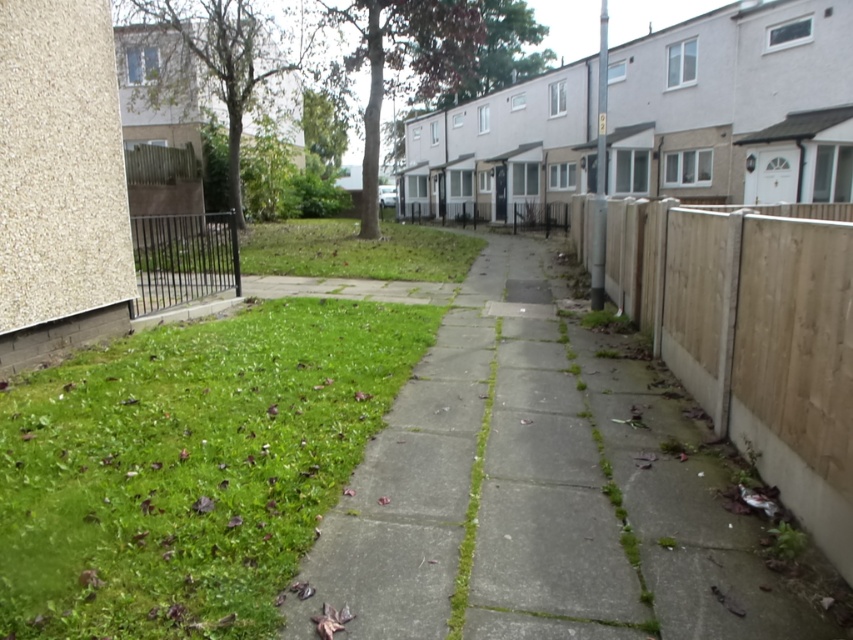
Question: Can you confirm if brown wooden fence at right is wider than black metal fence at lower left?

Choices:
 (A) yes
 (B) no

Answer: (B)

Question: Which of the following is the farthest from the observer?

Choices:
 (A) (126, 464)
 (B) (619, 284)
 (C) (590, 461)
 (D) (155, 264)

Answer: (D)

Question: Does green concrete pavement at center appear on the right side of black metal fence at lower left?

Choices:
 (A) no
 (B) yes

Answer: (B)

Question: Does green grass at lower left come behind brown wooden fence at right?

Choices:
 (A) no
 (B) yes

Answer: (A)

Question: Among these points, which one is nearest to the camera?

Choices:
 (A) [190, 232]
 (B) [314, 512]
 (C) [776, 252]
 (D) [506, 292]

Answer: (B)

Question: Which of these objects is positioned closest to the black metal fence at lower left?

Choices:
 (A) brown wooden fence at right
 (B) green concrete pavement at center
 (C) green grass at lower left

Answer: (C)